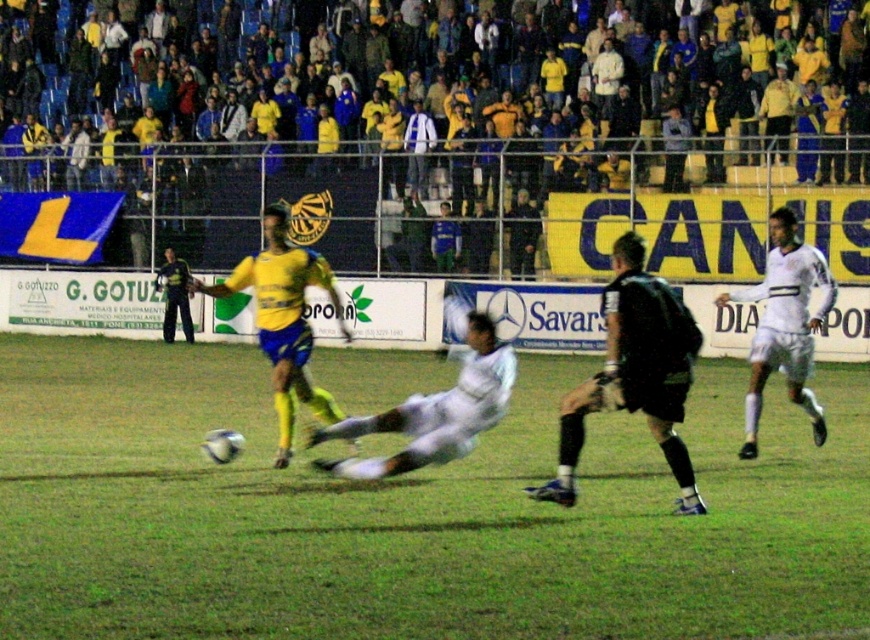
Who is positioned more to the left, green grass at center or black matte jersey at center?

From the viewer's perspective, green grass at center appears more on the left side.

Between green grass at center and black matte jersey at center, which one is positioned higher?

Positioned higher is black matte jersey at center.

Does point (11, 468) come closer to viewer compared to point (644, 403)?

No.

Find the location of `green grass at center`. green grass at center is located at coordinates (412, 513).

Is the position of green grass at center more distant than that of white matte jersey at right?

No.

Does point (600, 477) come behind point (785, 236)?

No, (600, 477) is closer to viewer.

Locate an element on the screen. The width and height of the screenshot is (870, 640). green grass at center is located at coordinates (412, 513).

Who is higher up, white matte jersey at center or matte black goalkeeper at left?

matte black goalkeeper at left is above.

Does white matte jersey at center appear under matte black goalkeeper at left?

Indeed, white matte jersey at center is positioned under matte black goalkeeper at left.

Identify the location of white matte jersey at center. (435, 406).